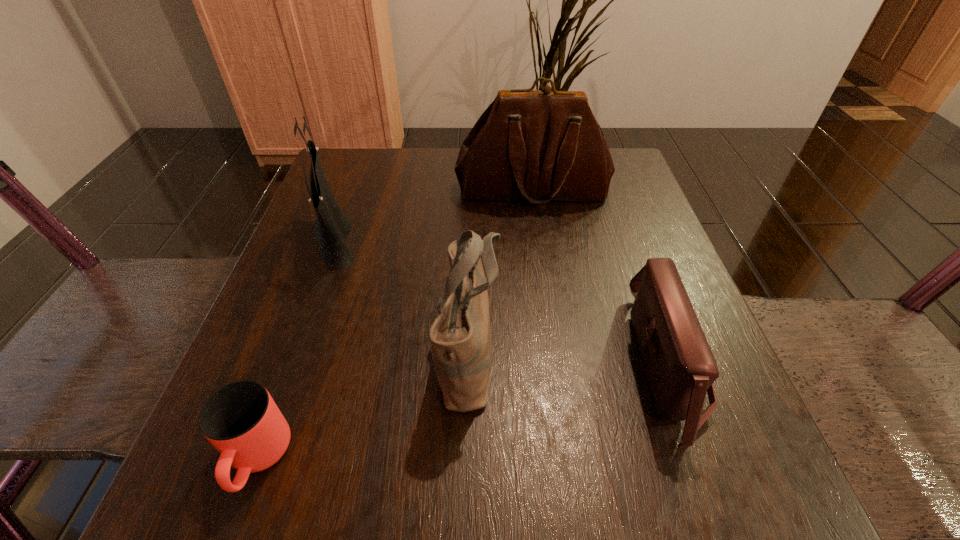
Find the location of `free spot at the far right corner of the desktop`. free spot at the far right corner of the desktop is located at coordinates (614, 200).

Select which object appears as the closest to the leftmost shoulder bag. Please provide its 2D coordinates. Your answer should be formatted as a tuple, i.e. [(x, y)], where the tuple contains the x and y coordinates of a point satisfying the conditions above.

[(460, 337)]

What are the coordinates of `object identified as the closest to the cup` in the screenshot? It's located at (460, 337).

Select which shoulder bag is the second closest to the shortest object. Please provide its 2D coordinates. Your answer should be formatted as a tuple, i.e. [(x, y)], where the tuple contains the x and y coordinates of a point satisfying the conditions above.

[(332, 227)]

This screenshot has height=540, width=960. I want to click on shoulder bag that stands as the second closest to the second shortest object, so tap(540, 146).

Locate an element on the screen. vacant position in the image that satisfies the following two spatial constraints: 1. on the front flap of the shortest shoulder bag; 2. on the handle side of the cup is located at coordinates (701, 458).

Where is `vacant region that satisfies the following two spatial constraints: 1. on the front flap of the shortest shoulder bag; 2. on the handle side of the shortest object`? The image size is (960, 540). vacant region that satisfies the following two spatial constraints: 1. on the front flap of the shortest shoulder bag; 2. on the handle side of the shortest object is located at coordinates (701, 458).

You are a GUI agent. You are given a task and a screenshot of the screen. Output one action in this format:
    pyautogui.click(x=<x>, y=<y>)
    Task: Click on the free space that satisfies the following two spatial constraints: 1. on the front flap of the shortest shoulder bag; 2. on the handle side of the cup
    
    Given the screenshot: What is the action you would take?
    pyautogui.click(x=701, y=458)